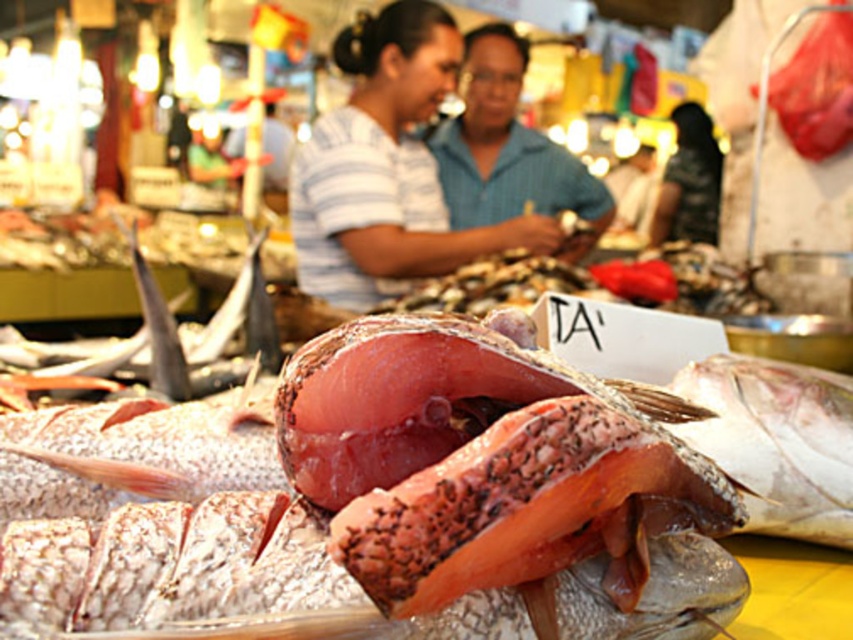
Which is more to the right, shiny silver fish at center or blue striped shirt at center?

Positioned to the right is shiny silver fish at center.

Is the position of shiny silver fish at center more distant than that of blue striped shirt at center?

That is False.

Who is more forward, (668, 385) or (521, 83)?

Point (668, 385)

Where is `shiny silver fish at center`? The width and height of the screenshot is (853, 640). shiny silver fish at center is located at coordinates (776, 442).

Is matte striped shirt at center positioned behind blue striped shirt at center?

That is False.

Image resolution: width=853 pixels, height=640 pixels. I want to click on matte striped shirt at center, so click(387, 168).

Where is `matte striped shirt at center`? The height and width of the screenshot is (640, 853). matte striped shirt at center is located at coordinates click(387, 168).

Identify the location of matte striped shirt at center. (387, 168).

Which is more to the right, matte striped shirt at center or shiny silver fish at center?

shiny silver fish at center

Is matte striped shirt at center thinner than shiny silver fish at center?

Incorrect, matte striped shirt at center's width is not less than shiny silver fish at center's.

The width and height of the screenshot is (853, 640). What are the coordinates of `matte striped shirt at center` in the screenshot? It's located at (387, 168).

Locate an element on the screen. The height and width of the screenshot is (640, 853). matte striped shirt at center is located at coordinates (387, 168).